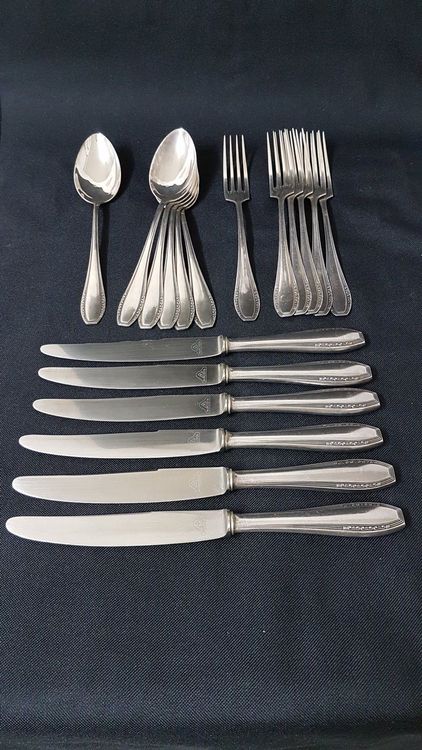
Identify the location of forks. (248, 285), (285, 283), (302, 286), (314, 288), (322, 289), (341, 291).